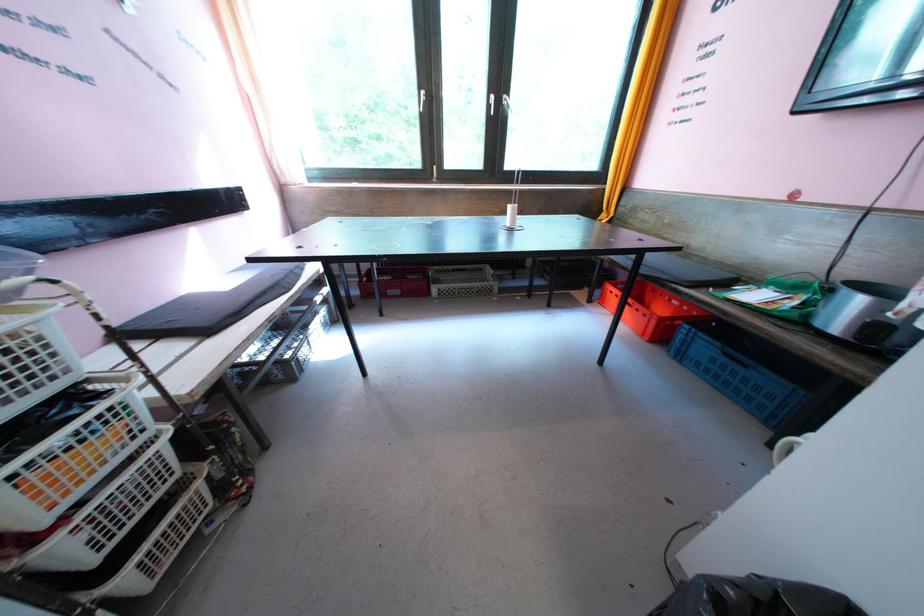
At what (x,y) coordinates should I click in order to perform the action: click on silver rice cooker. Please return your answer as a coordinate pair (x, y). Looking at the image, I should click on (869, 315).